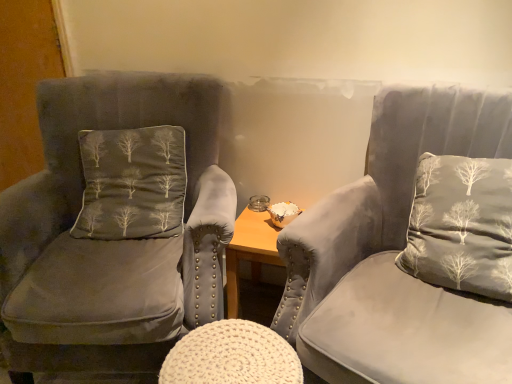
Identify the location of gray fabric pillow at right, which is counted as the second pillow, starting from the left. This screenshot has height=384, width=512. (461, 225).

This screenshot has height=384, width=512. In order to click on velvet gray chair at right, arranged as the first chair when viewed from the right in this screenshot , I will do `click(411, 249)`.

In the scene shown: From the image's perspective, is gray fabric pillow at right, which is counted as the second pillow, starting from the left, above white knitted stool at center?

Yes.

Is white knitted stool at center at the back of gray fabric pillow at right, arranged as the 1th pillow when viewed from the right?

No, white knitted stool at center is not at the back of gray fabric pillow at right, arranged as the 1th pillow when viewed from the right.

Does gray fabric pillow at right, arranged as the 1th pillow when viewed from the right, have a smaller size compared to white knitted stool at center?

Actually, gray fabric pillow at right, arranged as the 1th pillow when viewed from the right, might be larger than white knitted stool at center.

Are gray fabric pillow at right, arranged as the 1th pillow when viewed from the right, and velvet gray chair at right, the 2th chair from the left, making contact?

Yes, the surface of gray fabric pillow at right, arranged as the 1th pillow when viewed from the right, is in contact with velvet gray chair at right, the 2th chair from the left.

Which is more to the left, gray fabric pillow at right, arranged as the 1th pillow when viewed from the right, or velvet gray chair at right, arranged as the first chair when viewed from the right?

velvet gray chair at right, arranged as the first chair when viewed from the right, is more to the left.

Locate an element on the screen. The image size is (512, 384). pillow that is the 2nd one above the velvet gray chair at right, arranged as the first chair when viewed from the right (from a real-world perspective) is located at coordinates (461, 225).

Is gray fabric pillow at right, arranged as the 1th pillow when viewed from the right, not within velvet gray chair at right, arranged as the first chair when viewed from the right?

Actually, gray fabric pillow at right, arranged as the 1th pillow when viewed from the right, is at least partially inside velvet gray chair at right, arranged as the first chair when viewed from the right.

In the scene shown: From the image's perspective, which one is positioned lower, dark gray velvet pillow with tree pattern at left, positioned as the 1th pillow in left-to-right order, or velvet gray chair at right, arranged as the first chair when viewed from the right?

velvet gray chair at right, arranged as the first chair when viewed from the right, is shown below in the image.

Considering the points (112, 236) and (314, 293), which point is behind, point (112, 236) or point (314, 293)?

The point (112, 236) is behind.

Starting from the dark gray velvet pillow with tree pattern at left, positioned as the 1th pillow in left-to-right order, which chair is the 2nd one in front? Please provide its 2D coordinates.

[(411, 249)]

Considering the relative sizes of dark gray velvet pillow with tree pattern at left, positioned as the 1th pillow in left-to-right order, and velvet gray chair at right, the 2th chair from the left, in the image provided, is dark gray velvet pillow with tree pattern at left, positioned as the 1th pillow in left-to-right order, shorter than velvet gray chair at right, the 2th chair from the left,?

Indeed, dark gray velvet pillow with tree pattern at left, positioned as the 1th pillow in left-to-right order, has a lesser height compared to velvet gray chair at right, the 2th chair from the left.

From the image's perspective, is gray fabric pillow at right, which is counted as the second pillow, starting from the left, located beneath dark gray velvet pillow with tree pattern at left, positioned as the 1th pillow in left-to-right order?

Yes.

Looking at this image, can you confirm if gray fabric pillow at right, which is counted as the second pillow, starting from the left, is shorter than dark gray velvet pillow with tree pattern at left, positioned as the 1th pillow in left-to-right order?

Incorrect, the height of gray fabric pillow at right, which is counted as the second pillow, starting from the left, does not fall short of that of dark gray velvet pillow with tree pattern at left, positioned as the 1th pillow in left-to-right order.

Considering the relative positions of gray fabric pillow at right, which is counted as the second pillow, starting from the left, and dark gray velvet pillow with tree pattern at left, positioned as the 1th pillow in left-to-right order, in the image provided, is gray fabric pillow at right, which is counted as the second pillow, starting from the left, to the left of dark gray velvet pillow with tree pattern at left, positioned as the 1th pillow in left-to-right order, from the viewer's perspective?

Incorrect, gray fabric pillow at right, which is counted as the second pillow, starting from the left, is not on the left side of dark gray velvet pillow with tree pattern at left, positioned as the 1th pillow in left-to-right order.

In the scene shown: Is gray fabric pillow at right, arranged as the 1th pillow when viewed from the right, aimed at dark gray velvet pillow with tree pattern at left, which ranks as the 2th pillow in right-to-left order?

No, gray fabric pillow at right, arranged as the 1th pillow when viewed from the right, is not turned towards dark gray velvet pillow with tree pattern at left, which ranks as the 2th pillow in right-to-left order.

In order to click on the 1st chair below when counting from the dark gray velvet pillow with tree pattern at left, which ranks as the 2th pillow in right-to-left order (from the image's perspective) in this screenshot , I will do pyautogui.click(x=115, y=228).

From the image's perspective, which is above, suede gray chair at left, which appears as the 2th chair when viewed from the right, or dark gray velvet pillow with tree pattern at left, positioned as the 1th pillow in left-to-right order?

dark gray velvet pillow with tree pattern at left, positioned as the 1th pillow in left-to-right order.

From the picture: Is suede gray chair at left, which appears as the 2th chair when viewed from the right, oriented towards dark gray velvet pillow with tree pattern at left, positioned as the 1th pillow in left-to-right order?

Yes, suede gray chair at left, which appears as the 2th chair when viewed from the right, is turned towards dark gray velvet pillow with tree pattern at left, positioned as the 1th pillow in left-to-right order.

Is velvet gray chair at right, the 2th chair from the left, facing towards gray fabric pillow at right, arranged as the 1th pillow when viewed from the right?

Yes, velvet gray chair at right, the 2th chair from the left, is aimed at gray fabric pillow at right, arranged as the 1th pillow when viewed from the right.

Consider the image. Is velvet gray chair at right, arranged as the first chair when viewed from the right, inside or outside of gray fabric pillow at right, which is counted as the second pillow, starting from the left?

velvet gray chair at right, arranged as the first chair when viewed from the right, is not enclosed by gray fabric pillow at right, which is counted as the second pillow, starting from the left.

Is the surface of velvet gray chair at right, arranged as the first chair when viewed from the right, in direct contact with gray fabric pillow at right, which is counted as the second pillow, starting from the left?

Yes, velvet gray chair at right, arranged as the first chair when viewed from the right, is beside gray fabric pillow at right, which is counted as the second pillow, starting from the left.

How much distance is there between gray fabric pillow at right, which is counted as the second pillow, starting from the left, and suede gray chair at left, which appears as the 2th chair when viewed from the right?

gray fabric pillow at right, which is counted as the second pillow, starting from the left, and suede gray chair at left, which appears as the 2th chair when viewed from the right, are 78.02 centimeters apart.

From the image's perspective, is gray fabric pillow at right, which is counted as the second pillow, starting from the left, above or below suede gray chair at left, which appears as the 2th chair when viewed from the right?

gray fabric pillow at right, which is counted as the second pillow, starting from the left, is above suede gray chair at left, which appears as the 2th chair when viewed from the right.

Which of these two, gray fabric pillow at right, which is counted as the second pillow, starting from the left, or suede gray chair at left, which appears as the 2th chair when viewed from the right, stands shorter?

gray fabric pillow at right, which is counted as the second pillow, starting from the left.

Does gray fabric pillow at right, which is counted as the second pillow, starting from the left, appear on the left side of suede gray chair at left, which appears as the 2th chair when viewed from the right?

No.

Identify the location of stool that appears below the gray fabric pillow at right, arranged as the 1th pillow when viewed from the right (from a real-world perspective). (232, 356).

You are a GUI agent. You are given a task and a screenshot of the screen. Output one action in this format:
    pyautogui.click(x=<x>, y=<y>)
    Task: Click on the 1st pillow behind the velvet gray chair at right, the 2th chair from the left, counting from the anchor's position
    This screenshot has width=512, height=384.
    Given the screenshot: What is the action you would take?
    pyautogui.click(x=461, y=225)

Considering their positions, is white knitted stool at center positioned closer to dark gray velvet pillow with tree pattern at left, positioned as the 1th pillow in left-to-right order, than velvet gray chair at right, arranged as the first chair when viewed from the right?

white knitted stool at center.

Looking at this image, from the image, which object appears to be farther from velvet gray chair at right, the 2th chair from the left, suede gray chair at left, which appears as the 2th chair when viewed from the right, or gray fabric pillow at right, which is counted as the second pillow, starting from the left?

suede gray chair at left, which appears as the 2th chair when viewed from the right, is further to velvet gray chair at right, the 2th chair from the left.

When comparing their distances from gray fabric pillow at right, which is counted as the second pillow, starting from the left, does white knitted stool at center or velvet gray chair at right, arranged as the first chair when viewed from the right, seem closer?

velvet gray chair at right, arranged as the first chair when viewed from the right, is closer to gray fabric pillow at right, which is counted as the second pillow, starting from the left.

Estimate the real-world distances between objects in this image. Which object is further from white knitted stool at center, suede gray chair at left, which is the first chair in left-to-right order, or dark gray velvet pillow with tree pattern at left, positioned as the 1th pillow in left-to-right order?

dark gray velvet pillow with tree pattern at left, positioned as the 1th pillow in left-to-right order, is further to white knitted stool at center.

When comparing their distances from velvet gray chair at right, the 2th chair from the left, does gray fabric pillow at right, arranged as the 1th pillow when viewed from the right, or suede gray chair at left, which appears as the 2th chair when viewed from the right, seem closer?

gray fabric pillow at right, arranged as the 1th pillow when viewed from the right, is closer to velvet gray chair at right, the 2th chair from the left.

From the image, which object appears to be farther from velvet gray chair at right, the 2th chair from the left, gray fabric pillow at right, arranged as the 1th pillow when viewed from the right, or white knitted stool at center?

Among the two, white knitted stool at center is located further to velvet gray chair at right, the 2th chair from the left.

Estimate the real-world distances between objects in this image. Which object is closer to gray fabric pillow at right, arranged as the 1th pillow when viewed from the right, velvet gray chair at right, arranged as the first chair when viewed from the right, or white knitted stool at center?

velvet gray chair at right, arranged as the first chair when viewed from the right, lies closer to gray fabric pillow at right, arranged as the 1th pillow when viewed from the right, than the other object.

Considering their positions, is white knitted stool at center positioned closer to dark gray velvet pillow with tree pattern at left, which ranks as the 2th pillow in right-to-left order, than gray fabric pillow at right, which is counted as the second pillow, starting from the left?

Among the two, white knitted stool at center is located nearer to dark gray velvet pillow with tree pattern at left, which ranks as the 2th pillow in right-to-left order.

Find the location of a particular element. The height and width of the screenshot is (384, 512). stool situated between suede gray chair at left, which appears as the 2th chair when viewed from the right, and velvet gray chair at right, the 2th chair from the left, from left to right is located at coordinates (232, 356).

Identify the location of stool situated between suede gray chair at left, which appears as the 2th chair when viewed from the right, and gray fabric pillow at right, which is counted as the second pillow, starting from the left, from left to right. This screenshot has height=384, width=512. (232, 356).

At what (x,y) coordinates should I click in order to perform the action: click on pillow situated between suede gray chair at left, which is the first chair in left-to-right order, and gray fabric pillow at right, arranged as the 1th pillow when viewed from the right, from left to right. Please return your answer as a coordinate pair (x, y). The image size is (512, 384). Looking at the image, I should click on (132, 183).

Identify the location of chair between dark gray velvet pillow with tree pattern at left, positioned as the 1th pillow in left-to-right order, and gray fabric pillow at right, which is counted as the second pillow, starting from the left, from left to right. (411, 249).